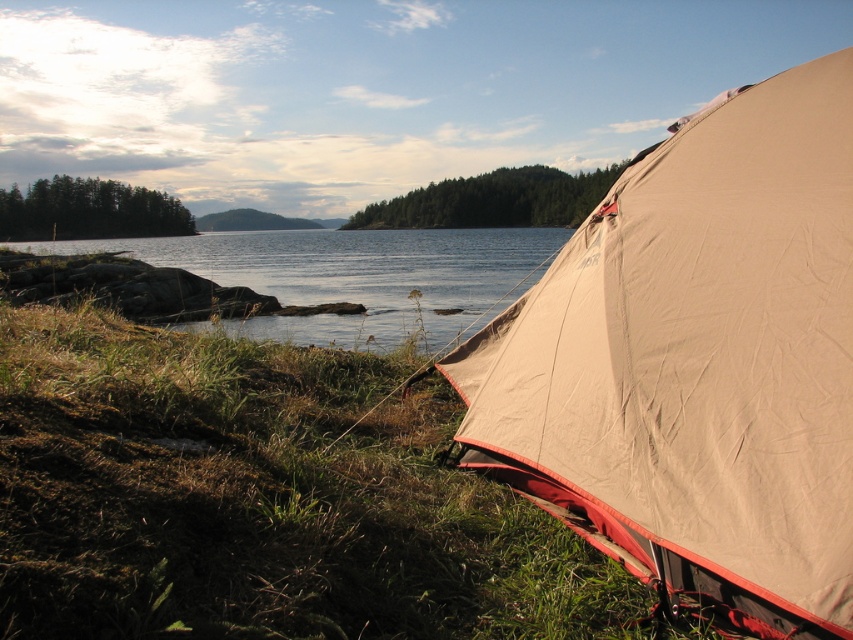
You are standing at the center of the image and want to locate the beige canvas tent at lower right. Which direction should you look to find it?

You should look to the lower right direction to find the beige canvas tent at lower right as it is located at point (697, 362).

You are a hiker who wants to set up a tent but needs to know the distance between the beige canvas tent at lower right and the clear water at lower left. Can you determine if they are close enough for easy access to water?

The beige canvas tent at lower right is in front of clear water at lower left, meaning they are positioned close to each other, so the distance is likely short enough for easy access to water.